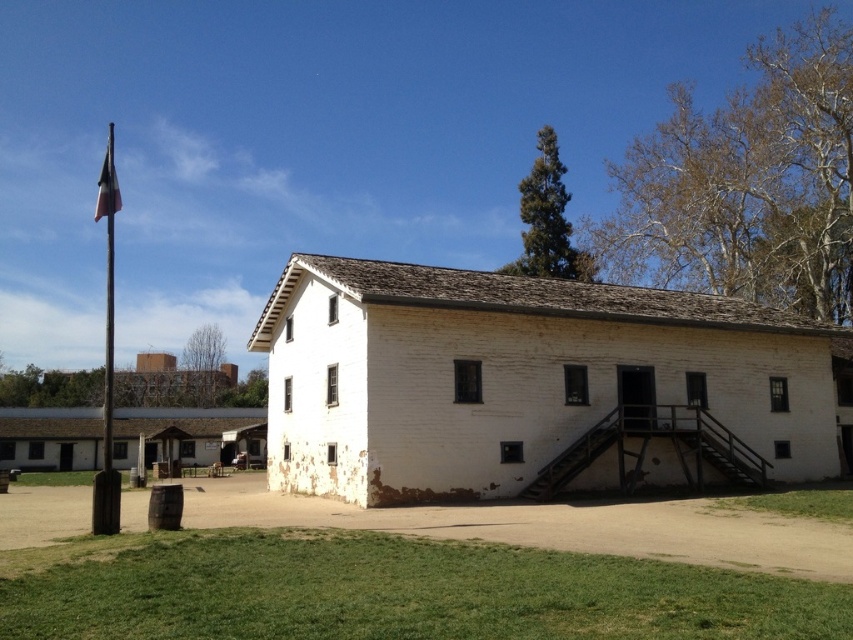
Between wooden flag pole at left and blue fabric flag at upper left, which one appears on the right side from the viewer's perspective?

blue fabric flag at upper left is more to the right.

Is point (107, 362) positioned behind point (119, 196)?

Yes, point (107, 362) is behind point (119, 196).

Where is `wooden flag pole at left`? This screenshot has height=640, width=853. wooden flag pole at left is located at coordinates (107, 356).